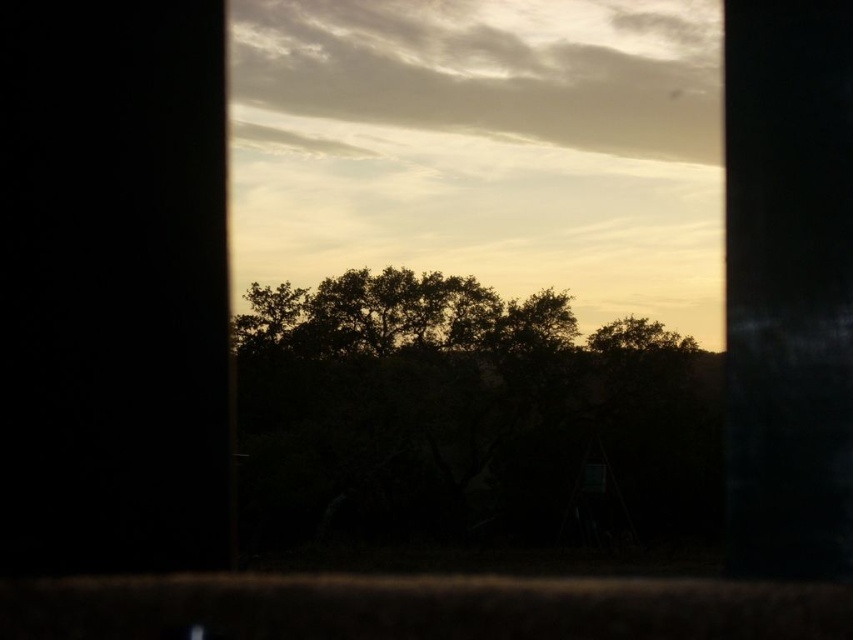
You are standing inside a room with a window frame. You notice two points marked on the window glass at coordinates point (x=294, y=360) and point (x=416, y=451). If you want to touch both points starting from the nearest one, which point should you touch first?

You should touch point (x=416, y=451) first because it is closer to you than point (x=294, y=360), which is further away.

You are an interior designer assessing the view from a room. You notice the transparent glass window at upper center and the silhouette leafy tree at center. Which object occupies a bigger area in the scene?

The transparent glass window at upper center is larger in size than the silhouette leafy tree at center, so it occupies a bigger area in the scene.